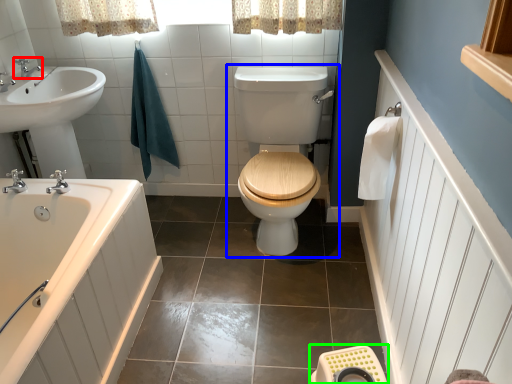
Question: Considering the real-world distances, which object is farthest from tap (highlighted by a red box)? toilet (highlighted by a blue box) or porcelain (highlighted by a green box)?

Choices:
 (A) toilet
 (B) porcelain

Answer: (B)